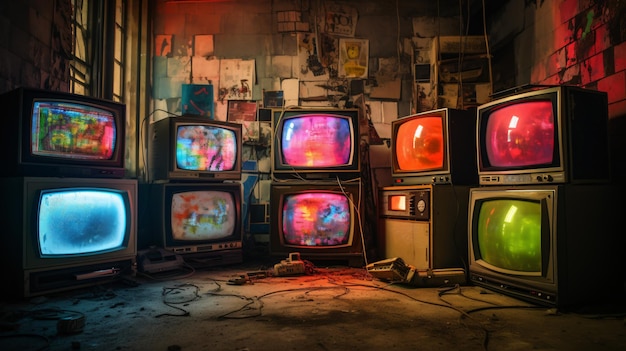
The image size is (626, 351). In order to click on tv screens in this screenshot , I will do [81, 149], [89, 209], [208, 149], [208, 206], [313, 139], [317, 209], [434, 149], [515, 139], [511, 224].